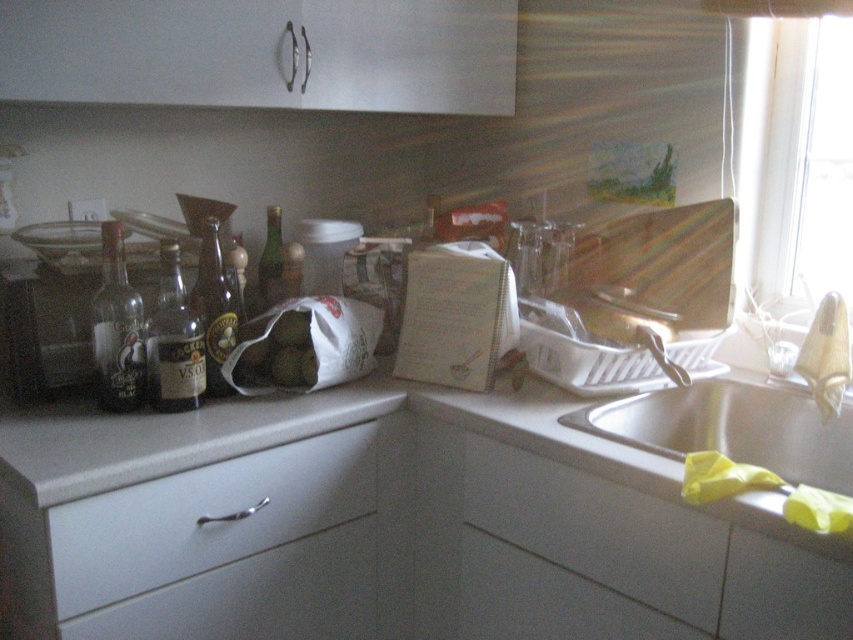
You are standing in the kitchen and want to reach the point at coordinates (x=123, y=556) on the countertop. If your arm can extend 1 meter, can you reach that point?

The point at coordinates (x=123, y=556) is 1.11 meters away from the camera, so your arm can only extend 1 meter, meaning you cannot reach it.

You are a robot trying to reach the white matte drawer at lower left. The robot is currently at position point [206,516]. Can you reach it?

The white matte drawer at lower left is represented by point [206,516], so the robot is already at the correct position to reach it.